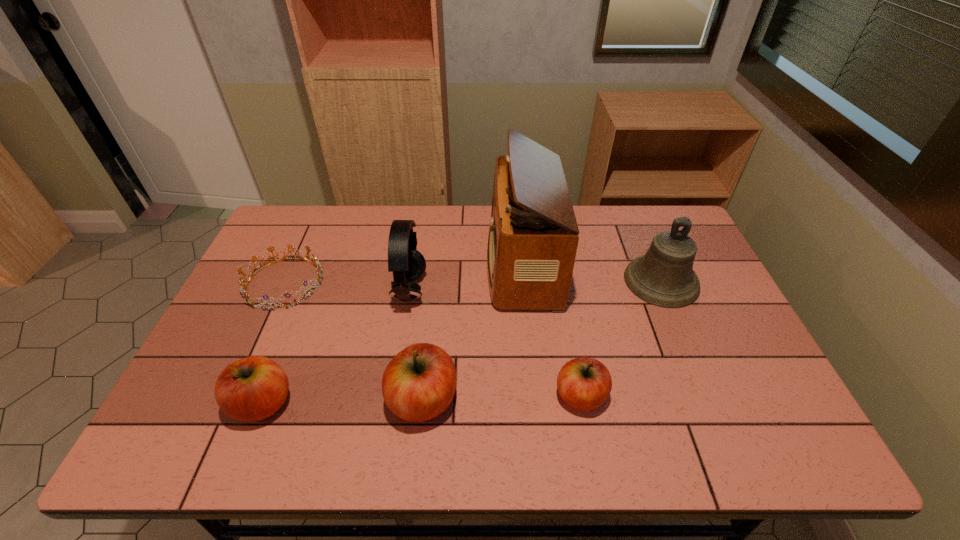
Locate an element on the screen. tiara positioned at the left edge is located at coordinates (315, 262).

Identify the location of object that is at the right edge. (664, 276).

This screenshot has height=540, width=960. Find the location of `object that is at the near left corner`. object that is at the near left corner is located at coordinates (253, 388).

In the image, there is a desktop. What are the coordinates of `vacant space at the far edge` in the screenshot? It's located at (x=585, y=228).

Identify the location of free region at the far right corner of the desktop. (676, 209).

Locate an element on the screen. This screenshot has width=960, height=540. vacant space that is in between the radio receiver and the earphone is located at coordinates (466, 278).

The width and height of the screenshot is (960, 540). In order to click on free spot between the leftmost apple and the rightmost object in this screenshot , I will do `click(462, 342)`.

Identify the location of empty space that is in between the shortest object and the second shortest object. The width and height of the screenshot is (960, 540). (432, 340).

The height and width of the screenshot is (540, 960). What are the coordinates of `vacant space in between the shortest apple and the tiara` in the screenshot? It's located at (432, 340).

Find the location of a particular element. vacant area that lies between the earphone and the tiara is located at coordinates (348, 287).